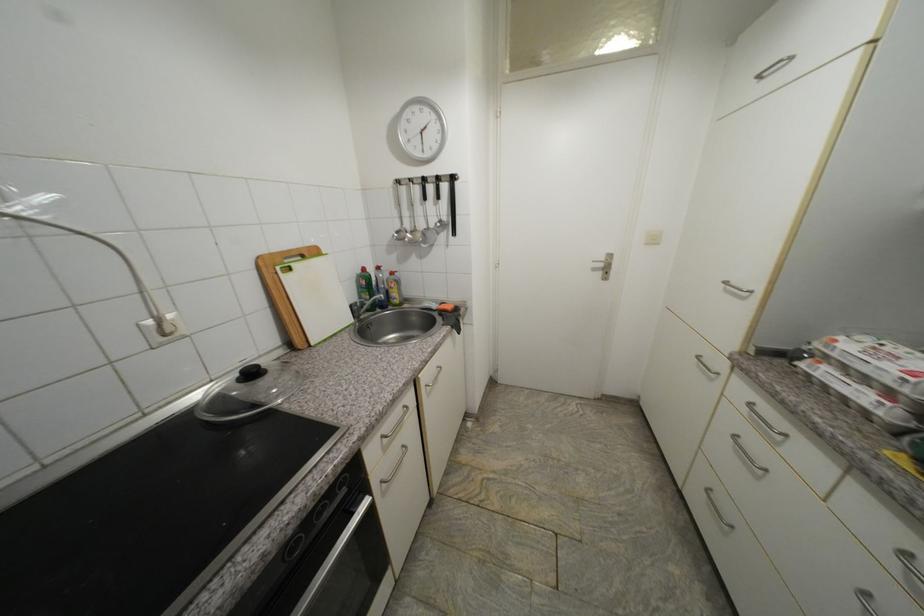
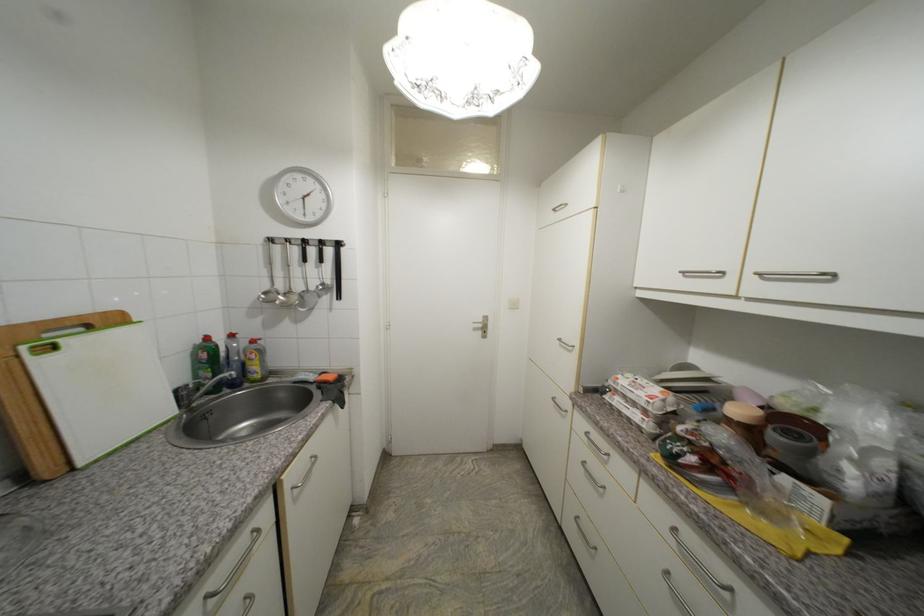
Locate, in the second image, the point that corresponds to point 714,371 in the first image.

(565, 410)